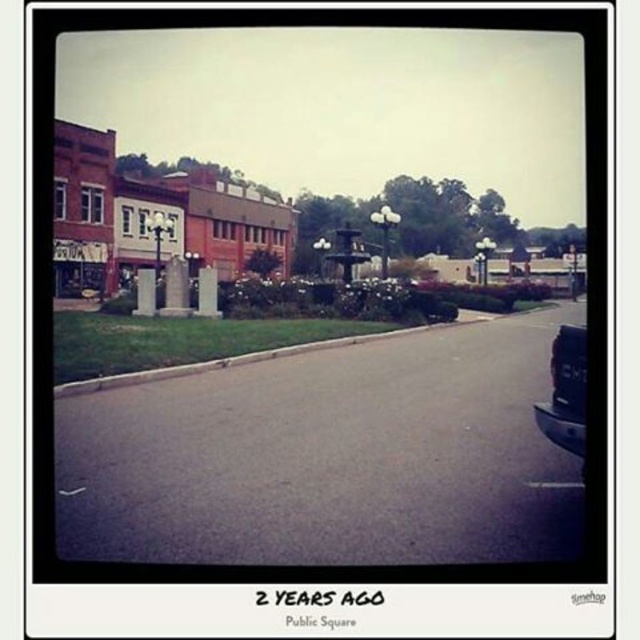
You are driving a car and want to safely pass the black matte truck at right. The minimum safe distance required to pass a vehicle is 5 meters. Based on the scene, can you safely pass the truck?

The black matte truck at right and viewer are 4.91 meters apart from each other, which is less than the required 5 meters for safe passing. Therefore, you should not attempt to pass the truck at this distance.

You are standing at the center of the road in the quiet street scene. Which direction should you walk to reach the brick building at left?

The brick building at left is located at coordinates point (148, 216), so you should walk towards the left direction to reach it.